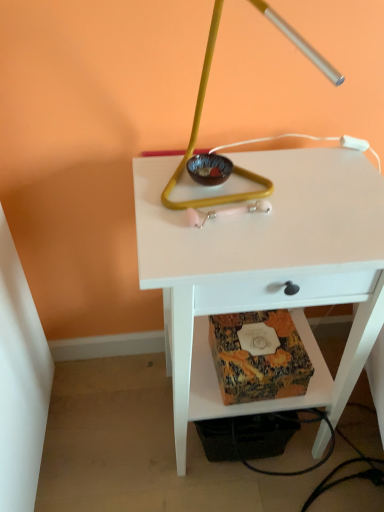
This screenshot has width=384, height=512. I want to click on free space above white matte table at center (from a real-world perspective), so click(x=274, y=194).